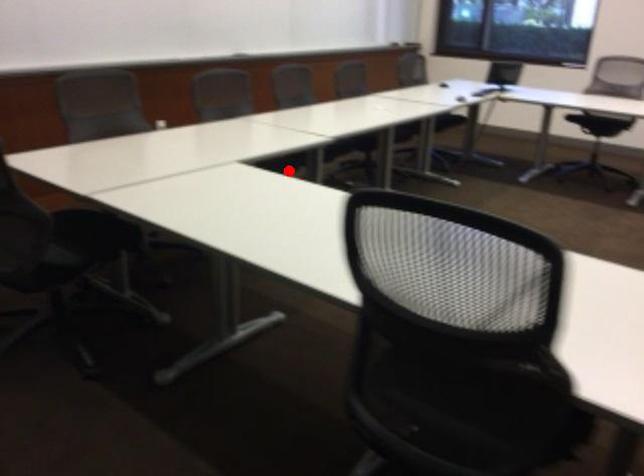
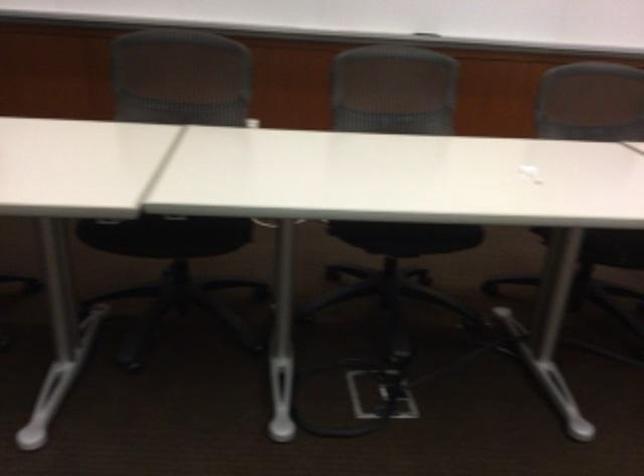
Question: I am providing you with two images of the same scene from different viewpoints. Image1 has a red point marked. In image2, the corresponding 3D location appears at what relative position? Reply with the corresponding letter.

Choices:
 (A) Closer
 (B) Farther

Answer: (A)